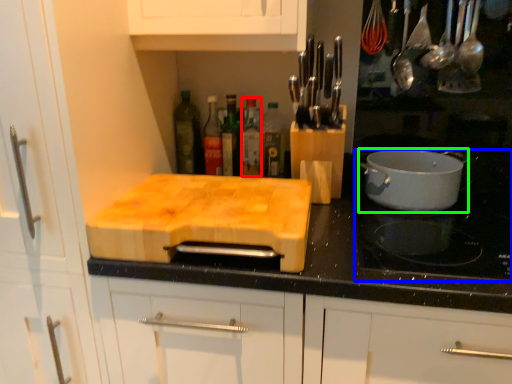
Question: Which is farther away from bottle (highlighted by a red box)? gas stove (highlighted by a blue box) or kitchen appliance (highlighted by a green box)?

Choices:
 (A) gas stove
 (B) kitchen appliance

Answer: (A)